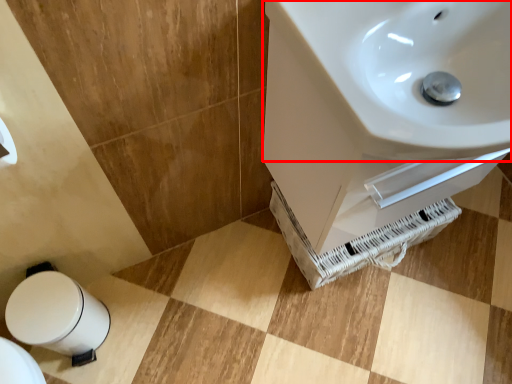
Question: Where is sink (annotated by the red box) located in relation to bidet in the image?

Choices:
 (A) left
 (B) right

Answer: (B)